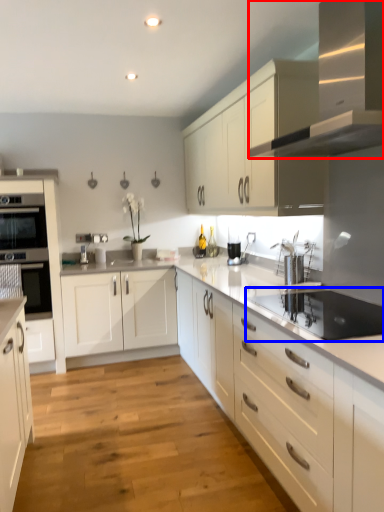
Question: Among these objects, which one is nearest to the camera, home appliance (highlighted by a red box) or appliance (highlighted by a blue box)?

Choices:
 (A) home appliance
 (B) appliance

Answer: (A)